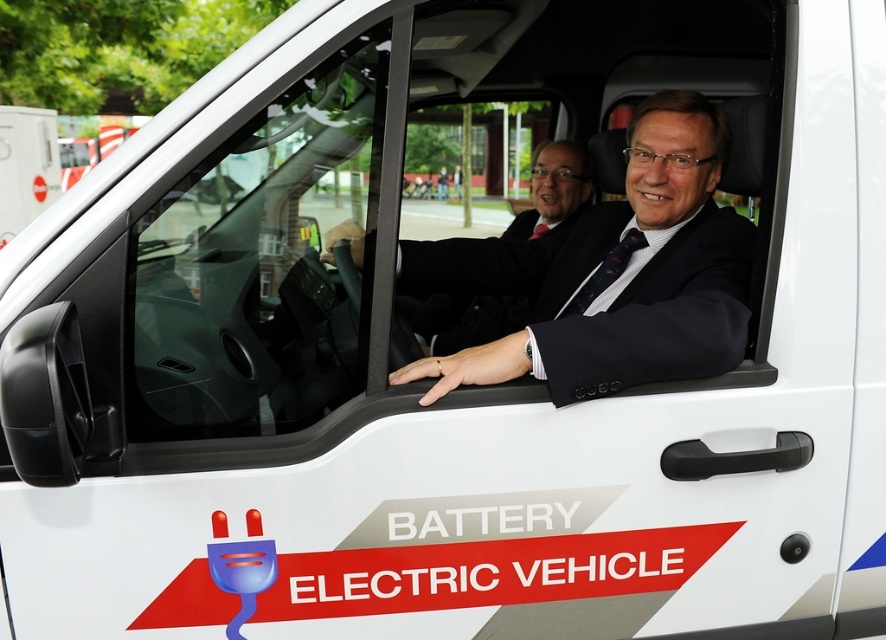
In the scene shown: You are standing 10 feet away from the electric vehicle. There is a point at coordinates point [571,298] on the vehicle. Can you reach that point without moving closer than 7 feet?

The distance of point [571,298] from viewer is 7.74 feet. Since you are currently 10 feet away, you need to move closer to 7.74 feet to reach it. However, the minimum allowed distance is 7 feet. Since 7.74 feet is greater than 7 feet, you can move to 7.74 feet and still stay within the 7 feet limit. Wait, actually, if you are at 10 feet, moving closer to 7.74 feet would be within the 7 feet limit? Hmm, maybe I need to clarify. The question says without moving closer than 7 feet. So the closest you can go

You are sitting in the backseat of the BATTERY ELECTRIC VEHICLE and want to reach both the point at coordinates point (x=583, y=310) and point (x=540, y=227). Which point should you reach for first to grab the one closer to you?

Point (x=583, y=310) is closer to the viewer than point (x=540, y=227), so you should reach for point (x=583, y=310) first.